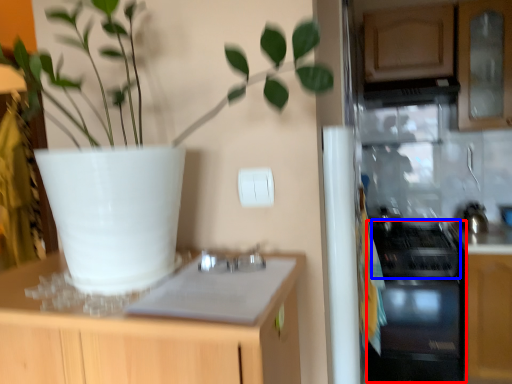
Question: Which of the following is the farthest to the observer, oven (highlighted by a red box) or gas stove (highlighted by a blue box)?

Choices:
 (A) oven
 (B) gas stove

Answer: (A)